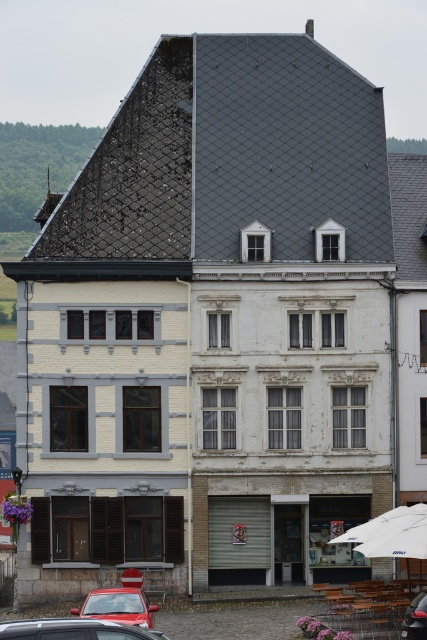
Question: Does metallic red car at lower left have a smaller size compared to shiny red car at lower left?

Choices:
 (A) no
 (B) yes

Answer: (B)

Question: Among these objects, which one is nearest to the camera?

Choices:
 (A) metallic red car at lower right
 (B) shiny red car at lower left
 (C) metallic red car at lower left

Answer: (C)

Question: Among these points, which one is nearest to the camera?

Choices:
 (A) (152, 630)
 (B) (420, 625)

Answer: (A)

Question: Is metallic red car at lower left smaller than metallic red car at lower right?

Choices:
 (A) yes
 (B) no

Answer: (B)

Question: Estimate the real-world distances between objects in this image. Which object is closer to the metallic red car at lower left?

Choices:
 (A) metallic red car at lower right
 (B) shiny red car at lower left

Answer: (B)

Question: Is metallic red car at lower left smaller than metallic red car at lower right?

Choices:
 (A) no
 (B) yes

Answer: (A)